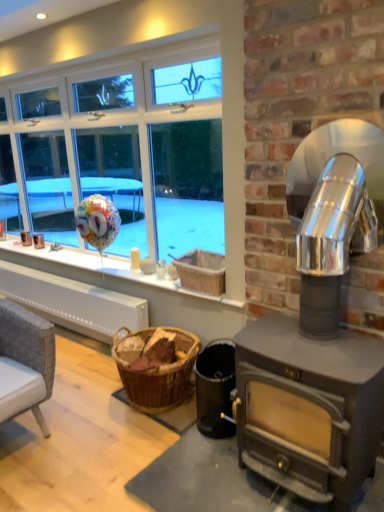
Question: Is wooden basket at center behind black matte wood stove at lower right?

Choices:
 (A) no
 (B) yes

Answer: (B)

Question: Does wooden basket at center contain black matte wood stove at lower right?

Choices:
 (A) yes
 (B) no

Answer: (B)

Question: Does wooden basket at center appear on the right side of black matte wood stove at lower right?

Choices:
 (A) yes
 (B) no

Answer: (B)

Question: Does wooden basket at center turn towards black matte wood stove at lower right?

Choices:
 (A) no
 (B) yes

Answer: (A)

Question: From the image's perspective, is wooden basket at center beneath black matte wood stove at lower right?

Choices:
 (A) no
 (B) yes

Answer: (A)

Question: In the image, is black matte wood stove at lower right positioned in front of or behind wooden basket at center?

Choices:
 (A) behind
 (B) front

Answer: (B)

Question: Considering the positions of black matte wood stove at lower right and wooden basket at center in the image, is black matte wood stove at lower right taller or shorter than wooden basket at center?

Choices:
 (A) short
 (B) tall

Answer: (B)

Question: From the image's perspective, relative to wooden basket at center, is black matte wood stove at lower right above or below?

Choices:
 (A) above
 (B) below

Answer: (B)

Question: Looking at the image, does black matte wood stove at lower right seem bigger or smaller compared to wooden basket at center?

Choices:
 (A) big
 (B) small

Answer: (A)

Question: Based on their sizes in the image, would you say wooden basket at center is bigger or smaller than metallic silver fireplace at right?

Choices:
 (A) big
 (B) small

Answer: (B)

Question: In terms of width, does wooden basket at center look wider or thinner when compared to metallic silver fireplace at right?

Choices:
 (A) thin
 (B) wide

Answer: (A)

Question: From the image's perspective, is wooden basket at center positioned above or below metallic silver fireplace at right?

Choices:
 (A) above
 (B) below

Answer: (A)

Question: Is wooden basket at center situated inside metallic silver fireplace at right or outside?

Choices:
 (A) inside
 (B) outside

Answer: (B)

Question: Based on their sizes in the image, would you say black matte wood stove at lower right is bigger or smaller than metallic silver fireplace at right?

Choices:
 (A) big
 (B) small

Answer: (B)

Question: In terms of width, does black matte wood stove at lower right look wider or thinner when compared to metallic silver fireplace at right?

Choices:
 (A) wide
 (B) thin

Answer: (B)